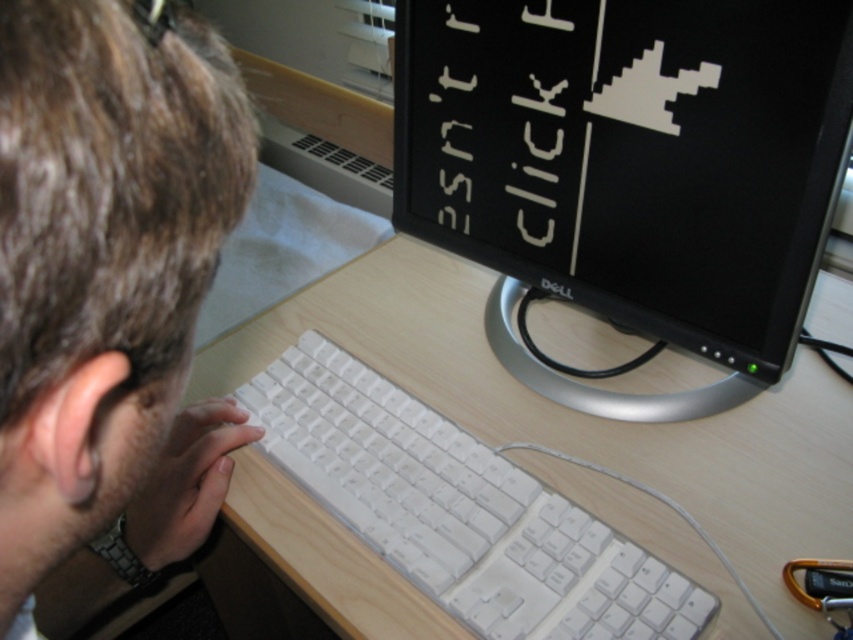
Who is higher up, black glossy monitor at upper center or light brown hair at upper left?

black glossy monitor at upper center

Measure the distance between black glossy monitor at upper center and camera.

The distance of black glossy monitor at upper center from camera is 52.01 centimeters.

Where is `black glossy monitor at upper center`? The width and height of the screenshot is (853, 640). black glossy monitor at upper center is located at coordinates (630, 168).

Is light brown hair at upper left to the left of white plastic keyboard at center from the viewer's perspective?

Indeed, light brown hair at upper left is positioned on the left side of white plastic keyboard at center.

Between point (103, 83) and point (531, 548), which one is positioned in front?

Point (103, 83)

The height and width of the screenshot is (640, 853). In order to click on light brown hair at upper left in this screenshot , I will do `click(109, 291)`.

Can you confirm if black glossy monitor at upper center is taller than white plastic keyboard at center?

Correct, black glossy monitor at upper center is much taller as white plastic keyboard at center.

Can you confirm if black glossy monitor at upper center is positioned above white plastic keyboard at center?

Correct, black glossy monitor at upper center is located above white plastic keyboard at center.

You are a GUI agent. You are given a task and a screenshot of the screen. Output one action in this format:
    pyautogui.click(x=<x>, y=<y>)
    Task: Click on the black glossy monitor at upper center
    
    Given the screenshot: What is the action you would take?
    pyautogui.click(x=630, y=168)